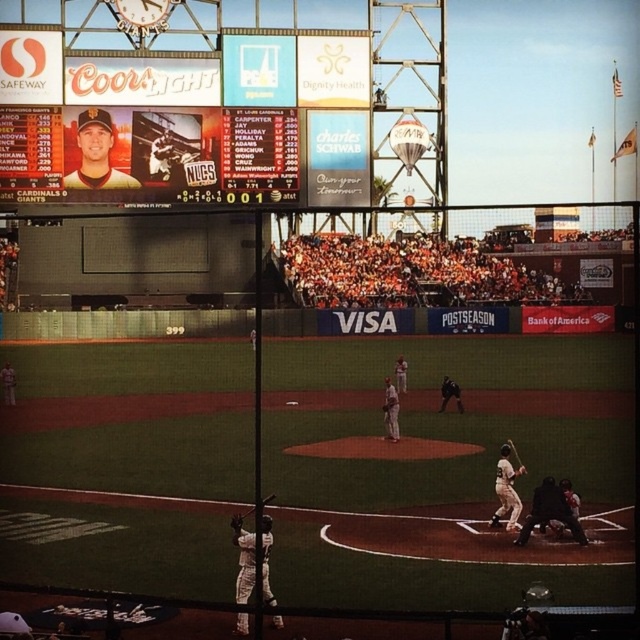
You are a photographer standing at the edge of the field. You want to take a photo of the wooden bat at center without the black matte umpire at lower right blocking the view. Is this possible given their positions?

The black matte umpire at lower right is in front of the wooden bat at center, so the umpire is blocking the view of the bat. Therefore, it is not possible to take a photo of the wooden bat at center without the umpire blocking the view unless you move to a different angle or position.

You are a photographer at the baseball game and want to capture a photo of both the white matte uniform at center and the wooden bat at center. Based on their positions, which object should you focus on first to ensure both are in the frame?

The white matte uniform at center is to the left of the wooden bat at center, so you should focus on the wooden bat at center first to ensure both are in the frame.

You are a photographer standing at the center of the baseball field. You want to take a photo of the matte plastic scoreboard at upper center. Based on its position, where should you aim your camera to capture it in the frame?

The matte plastic scoreboard at upper center is located at point (160, 124) in 2D coordinates, so you should aim your camera towards the upper center area of the frame to capture it.